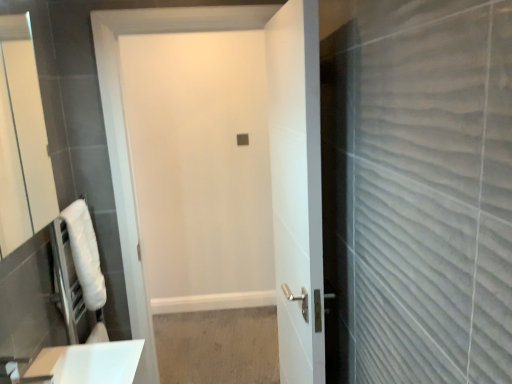
Question: Is point (24, 19) positioned closer to the camera than point (241, 8)?

Choices:
 (A) farther
 (B) closer

Answer: (A)

Question: Is matte white mirror at left in front of or behind white matte door at center, the first door in the left-to-right sequence, in the image?

Choices:
 (A) front
 (B) behind

Answer: (A)

Question: Which object is positioned closest to the white towel at left?

Choices:
 (A) white glossy door at center, which ranks as the 2th door in left-to-right order
 (B) white matte door at center, the first door in the left-to-right sequence
 (C) matte white mirror at left

Answer: (B)

Question: Considering the real-world distances, which object is farthest from the white glossy door at center, which ranks as the 2th door in left-to-right order?

Choices:
 (A) white towel at left
 (B) matte white mirror at left
 (C) white matte door at center, the first door in the left-to-right sequence

Answer: (B)